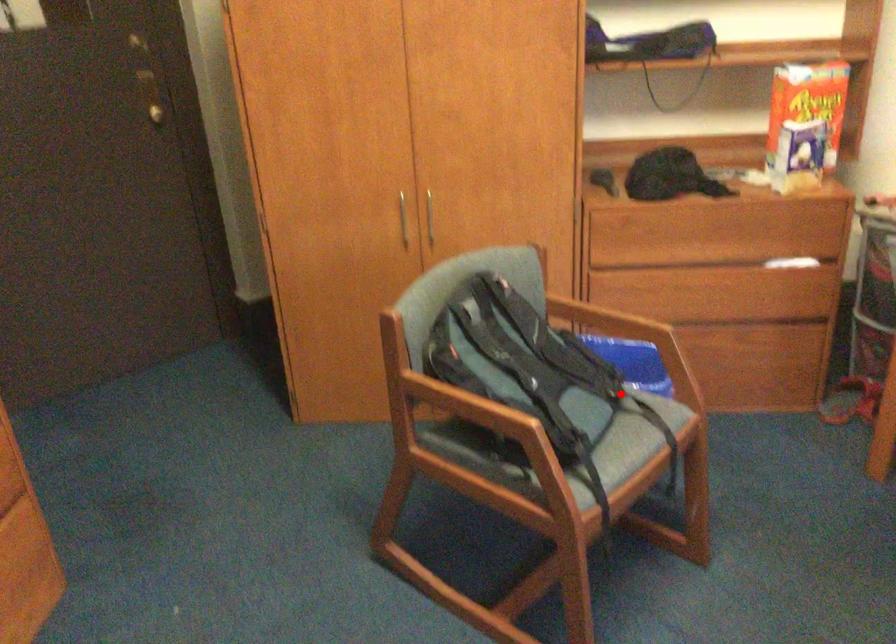
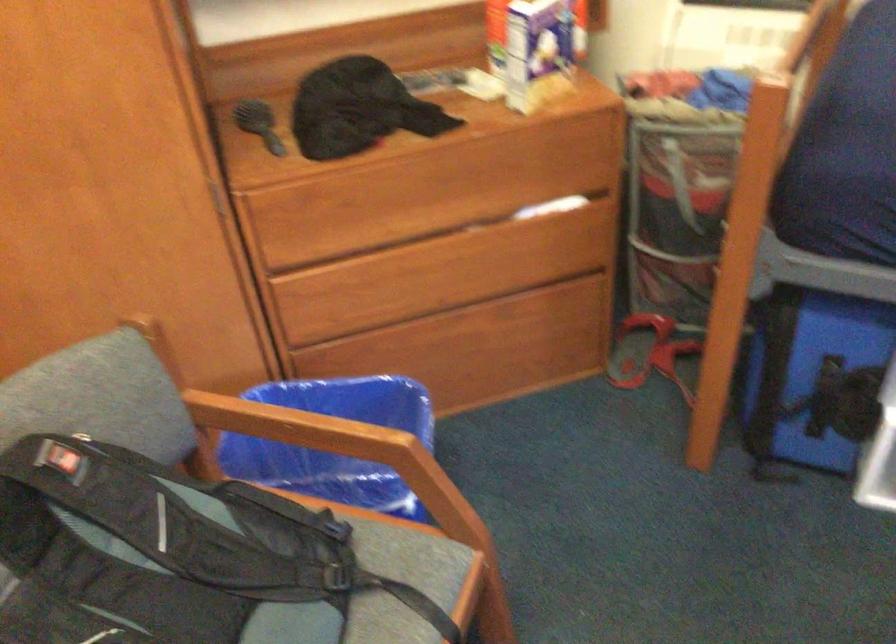
Question: I am providing you with two images of the same scene from different viewpoints. Given a red point in image1, look at the same physical point in image2. Is it:

Choices:
 (A) Closer to the viewpoint
 (B) Farther from the viewpoint

Answer: (A)